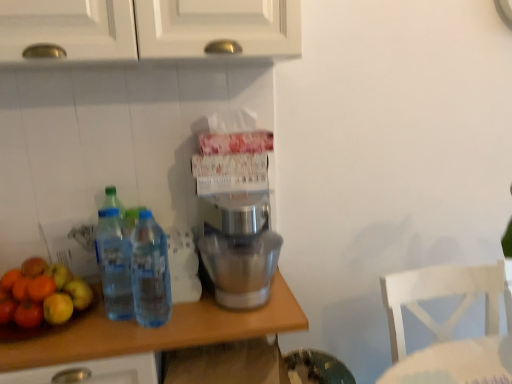
The height and width of the screenshot is (384, 512). Identify the location of free space in front of transparent plastic bottles at left, the second bottle viewed from the right. (106, 338).